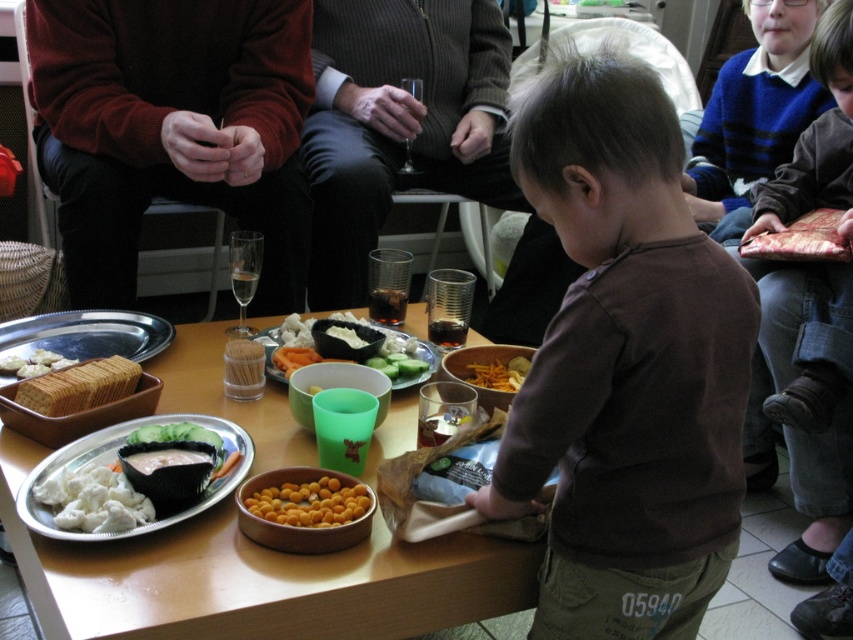
The width and height of the screenshot is (853, 640). Find the location of `wooden table at center`. wooden table at center is located at coordinates tap(254, 579).

Does wooden table at center have a lesser width compared to white crumbly cheese at center?

No.

Describe the element at coordinates (254, 579) in the screenshot. The image size is (853, 640). I see `wooden table at center` at that location.

What are the coordinates of `wooden table at center` in the screenshot? It's located at (254, 579).

Is brown cotton shirt at center smaller than white creamy cheese at lower left?

No.

Does brown cotton shirt at center appear under white creamy cheese at lower left?

No.

The image size is (853, 640). In order to click on brown cotton shirt at center in this screenshot , I will do click(625, 365).

At what (x,y) coordinates should I click in order to perform the action: click on brown cotton shirt at center. Please return your answer as a coordinate pair (x, y). Looking at the image, I should click on (625, 365).

Which is below, brown cotton shirt at center or wooden table at center?

wooden table at center

Measure the distance from brown cotton shirt at center to wooden table at center.

They are 14.64 inches apart.

Locate an element on the screen. brown cotton shirt at center is located at coordinates (625, 365).